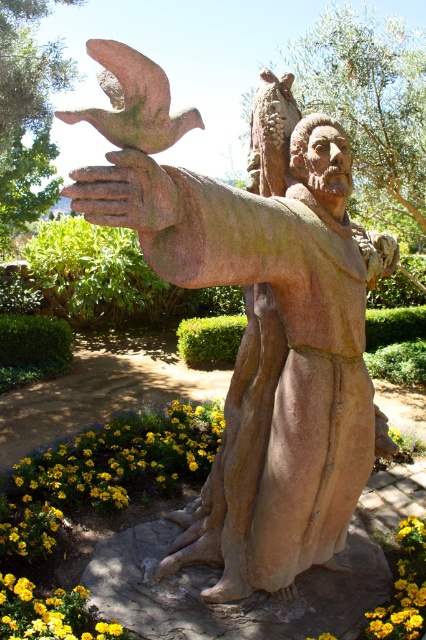
You are a photographer standing at a certain distance from the bronze statue at center. Your camera has a focal length of 50mm and you want to capture the statue in full without any cropping. Given that the statue is 2.1 meters tall, what is the minimum distance you should maintain to ensure the statue fits within the camera sensor height of 36mm?

The minimum distance required to capture the bronze statue at center in full is calculated using the formula distance > height of statue x sensor height. The bronze statue at center is 2.1 meters tall, and the sensor height is 36mm. Plugging in the values, distance > 2.1m x 36mm, which equals 75.6 meters. Therefore, you should maintain a distance greater than 75.6 meters to ensure the statue fits within the camera sensor height of 36mm.

You are a photographer standing in the scene. You want to take a photo of the bronze statue at center and the yellow matte flower at lower left. Which object should you focus on first to ensure both are in the frame?

The bronze statue at center is in front of the yellow matte flower at lower left, so you should focus on the bronze statue at center first to ensure both are in the frame.